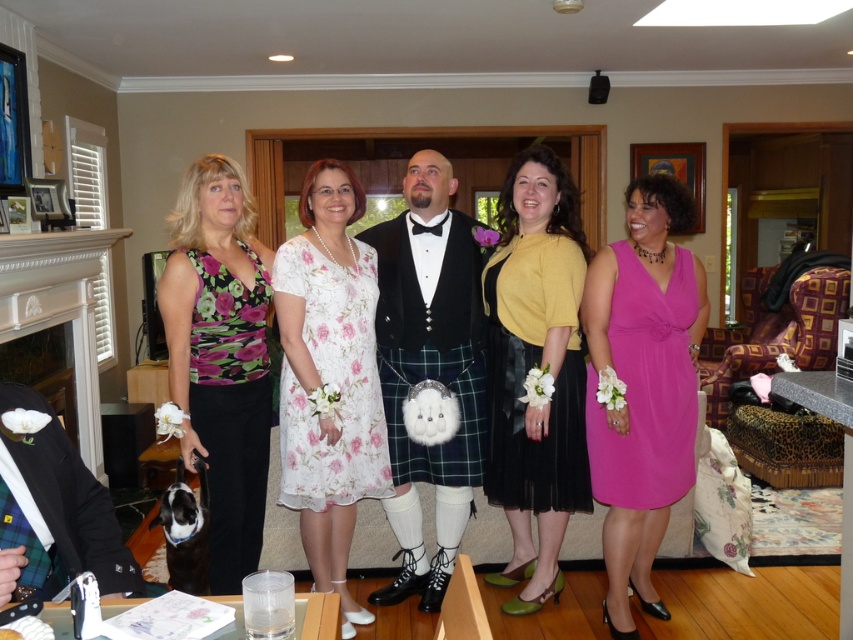
You are a photographer adjusting your camera settings to capture the group photo. You notice the floral chiffon dress at center and the black plaid kilt at center. Which one is closer to the camera?

The floral chiffon dress at center is in front of the black plaid kilt at center, so it is closer to the camera.

In the image, there are several people dressed in various outfits. The man in the center is wearing a black jacket, tartan kilt, white shirt, black bow tie, and knee socks with lace shoes. There is also a point marked at coordinates [646,387]. What is the clothing item located at this point?

The point at [646,387] corresponds to the matte pink dress at right.

You are a photographer setting up for a group photo. You need to ensure that the yellow matte dress at center and the velvet black vest at center are both visible in the frame. Based on their heights, which one might require you to adjust your camera angle to avoid being cut off?

The yellow matte dress at center has a lesser height compared to velvet black vest at center, so the velvet black vest at center may require adjusting the camera angle to avoid being cut off due to its greater height.